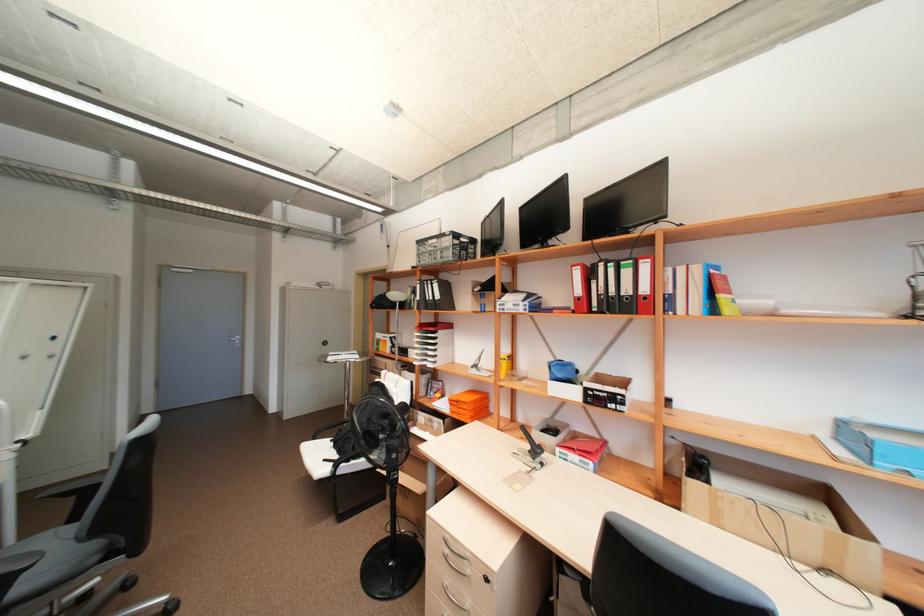
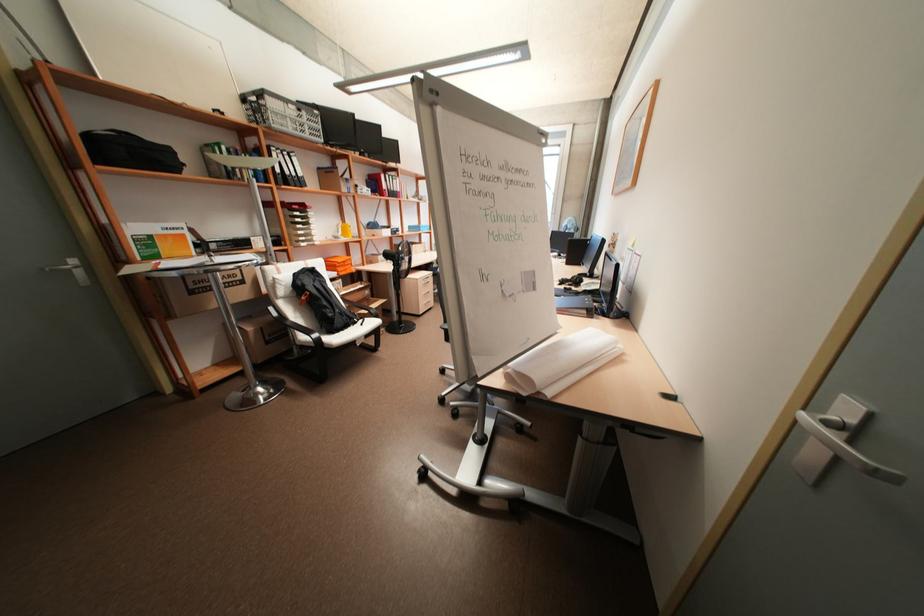
Locate, in the second image, the point that corresponds to (x=435, y=285) in the first image.

(293, 158)